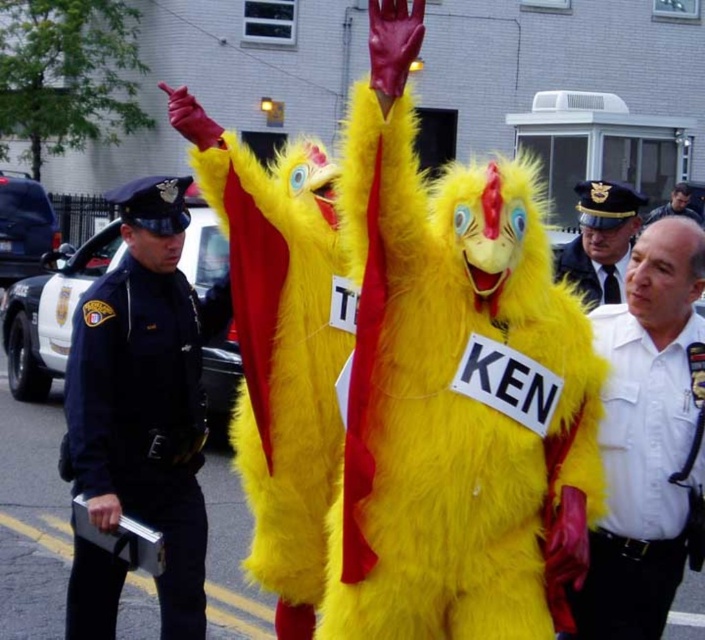
You are a photographer trying to capture a photo of the white uniform at center and the smooth black hair at center. Which object should you focus on first if you want to include both in your frame without moving the camera?

The white uniform at center is positioned on the left side of smooth black hair at center, so you should focus on the white uniform at center first to ensure both are in frame.

You are a delivery person with a package that requires a 10 meter clearance path. You need to move from the white uniform at center to the smooth black hair at center. Is the distance sufficient for your delivery vehicle?

The distance between the white uniform at center and the smooth black hair at center is 11.35 meters, which is greater than the required 10 meter clearance. Therefore, the delivery vehicle can safely navigate the path between them.